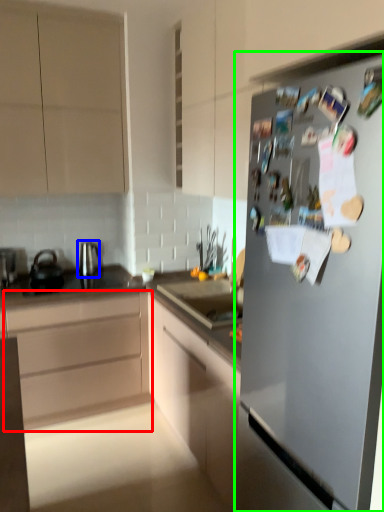
Question: Which object is the farthest from cabinetry (highlighted by a red box)? Choose among these: tea pot (highlighted by a blue box) or refrigerator (highlighted by a green box).

Choices:
 (A) tea pot
 (B) refrigerator

Answer: (B)